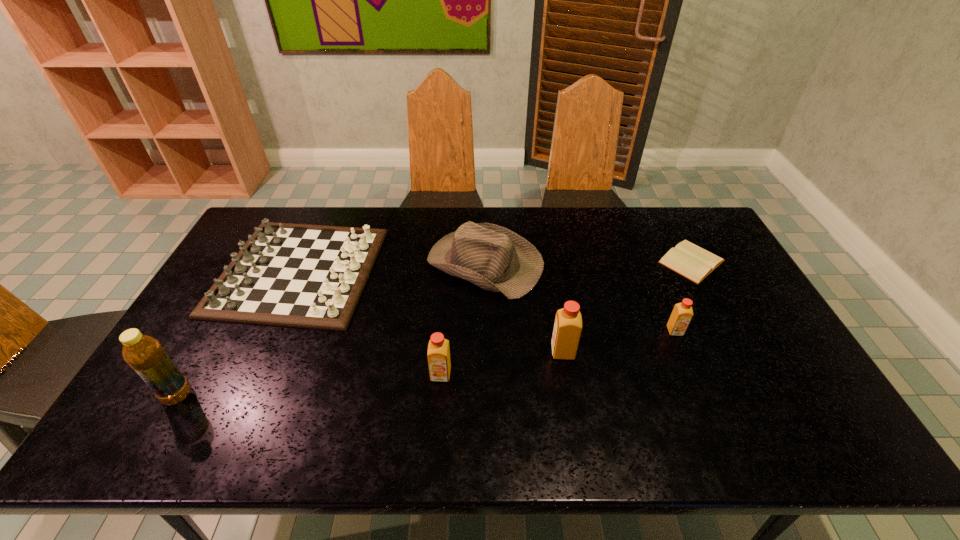
Locate an element on the screen. This screenshot has height=540, width=960. the tallest object is located at coordinates (143, 353).

Find the location of a particular element. This screenshot has height=540, width=960. vacant area situated on the front and back of the leftmost orange juice is located at coordinates (439, 404).

Where is `vacant space located on the front and back of the fifth farthest object`? This screenshot has width=960, height=540. vacant space located on the front and back of the fifth farthest object is located at coordinates tap(481, 352).

Identify the location of vacant space situated on the front and back of the fifth farthest object. (499, 352).

Find the location of a particular element. free location located on the front and back of the fifth farthest object is located at coordinates (444, 352).

Locate an element on the screen. Image resolution: width=960 pixels, height=540 pixels. free space located on the front and back of the farthest orange juice is located at coordinates (684, 352).

Find the location of a particular element. The height and width of the screenshot is (540, 960). vacant space located 0.110m on the back of the chessboard is located at coordinates (327, 207).

Find the location of a particular element. This screenshot has height=540, width=960. vacant space located 0.260m on the front of the fedora is located at coordinates (487, 375).

You are a GUI agent. You are given a task and a screenshot of the screen. Output one action in this format:
    pyautogui.click(x=<x>, y=<y>)
    Task: Click on the vacant region located 0.310m on the front of the rightmost object
    This screenshot has width=960, height=540.
    Given the screenshot: What is the action you would take?
    pyautogui.click(x=748, y=366)

This screenshot has width=960, height=540. I want to click on vacant space located 0.050m on the left of the tallest object, so pos(143,395).